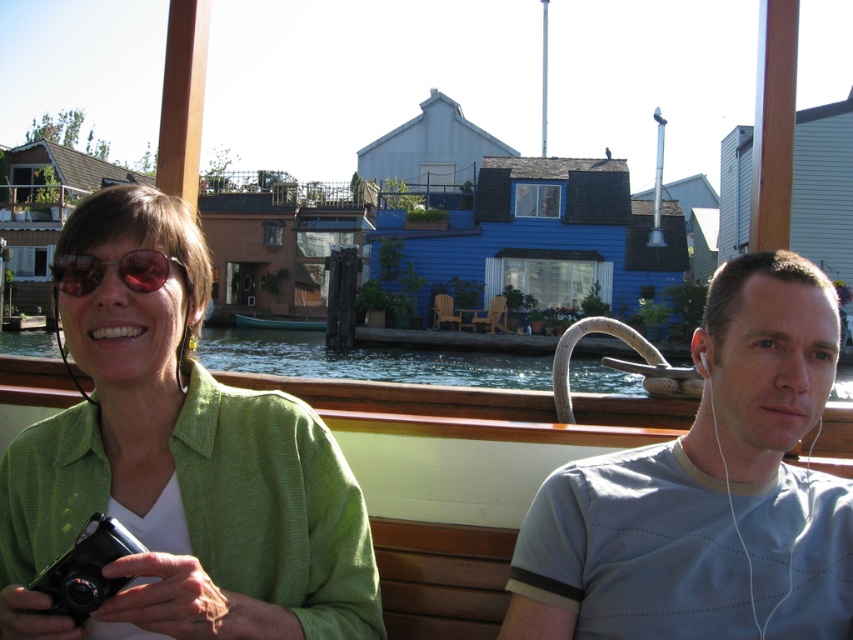
Between green textured shirt at left and teal wooden boat at center, which one has less height?

With less height is teal wooden boat at center.

Between green textured shirt at left and teal wooden boat at center, which one is positioned lower?

Positioned lower is teal wooden boat at center.

Is point (204, 570) positioned behind point (271, 326)?

No, it is not.

This screenshot has width=853, height=640. In order to click on green textured shirt at left in this screenshot , I will do `click(180, 467)`.

Is clear water at lower center to the left of red reflective sunglasses at center from the viewer's perspective?

Indeed, clear water at lower center is positioned on the left side of red reflective sunglasses at center.

Is clear water at lower center smaller than red reflective sunglasses at center?

No.

Identify the location of clear water at lower center. (366, 360).

Which of these two, green textured shirt at left or gray cotton t-shirt at right, stands shorter?

gray cotton t-shirt at right is shorter.

Is point (173, 595) in front of point (514, 593)?

Yes, it is.

Where is `green textured shirt at left`? green textured shirt at left is located at coordinates (180, 467).